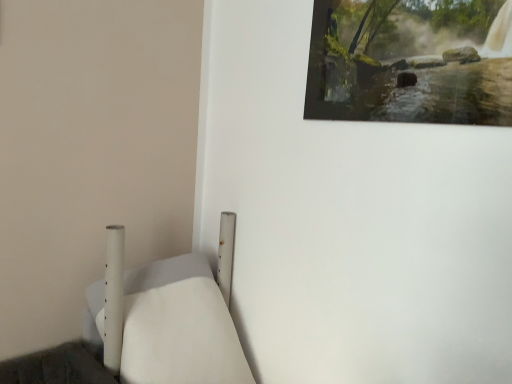
Question: Would you consider wooden painting at upper right to be distant from white matte bed at lower left?

Choices:
 (A) yes
 (B) no

Answer: (B)

Question: Can you confirm if wooden painting at upper right is taller than white matte bed at lower left?

Choices:
 (A) no
 (B) yes

Answer: (A)

Question: Considering the relative sizes of wooden painting at upper right and white matte bed at lower left in the image provided, is wooden painting at upper right shorter than white matte bed at lower left?

Choices:
 (A) yes
 (B) no

Answer: (A)

Question: Is wooden painting at upper right facing away from white matte bed at lower left?

Choices:
 (A) no
 (B) yes

Answer: (A)

Question: Does wooden painting at upper right have a greater width compared to white matte bed at lower left?

Choices:
 (A) no
 (B) yes

Answer: (A)

Question: Can you see wooden painting at upper right touching white matte bed at lower left?

Choices:
 (A) no
 (B) yes

Answer: (A)

Question: Is white matte bed at lower left located outside wooden painting at upper right?

Choices:
 (A) no
 (B) yes

Answer: (B)

Question: Is white matte bed at lower left not near wooden painting at upper right?

Choices:
 (A) no
 (B) yes

Answer: (A)

Question: Can you confirm if white matte bed at lower left is wider than wooden painting at upper right?

Choices:
 (A) yes
 (B) no

Answer: (A)

Question: Considering the relative sizes of white matte bed at lower left and wooden painting at upper right in the image provided, is white matte bed at lower left smaller than wooden painting at upper right?

Choices:
 (A) yes
 (B) no

Answer: (B)

Question: Is white matte bed at lower left positioned behind wooden painting at upper right?

Choices:
 (A) yes
 (B) no

Answer: (B)

Question: Does white matte bed at lower left come in front of wooden painting at upper right?

Choices:
 (A) no
 (B) yes

Answer: (B)

Question: Looking at their shapes, would you say wooden painting at upper right is wider or thinner than white matte bed at lower left?

Choices:
 (A) wide
 (B) thin

Answer: (B)